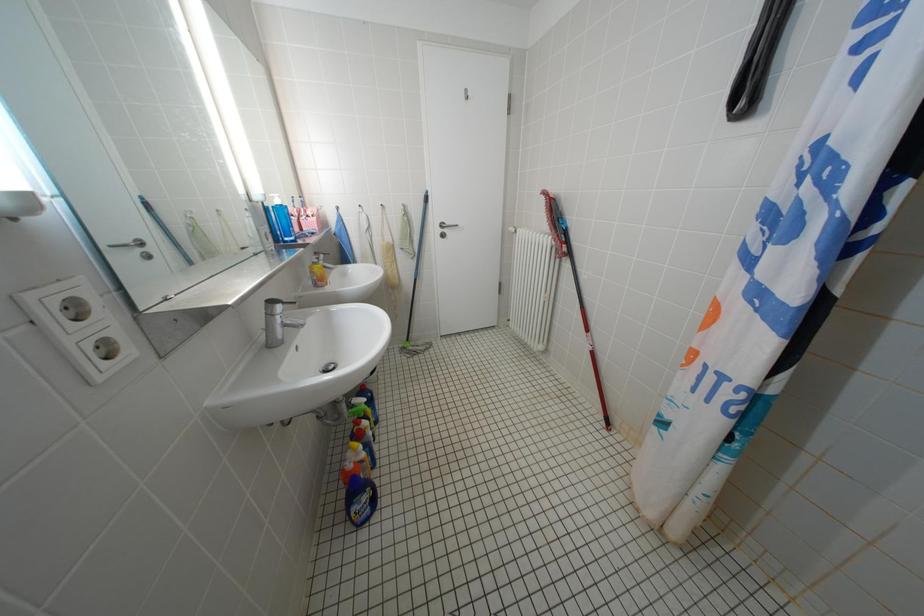
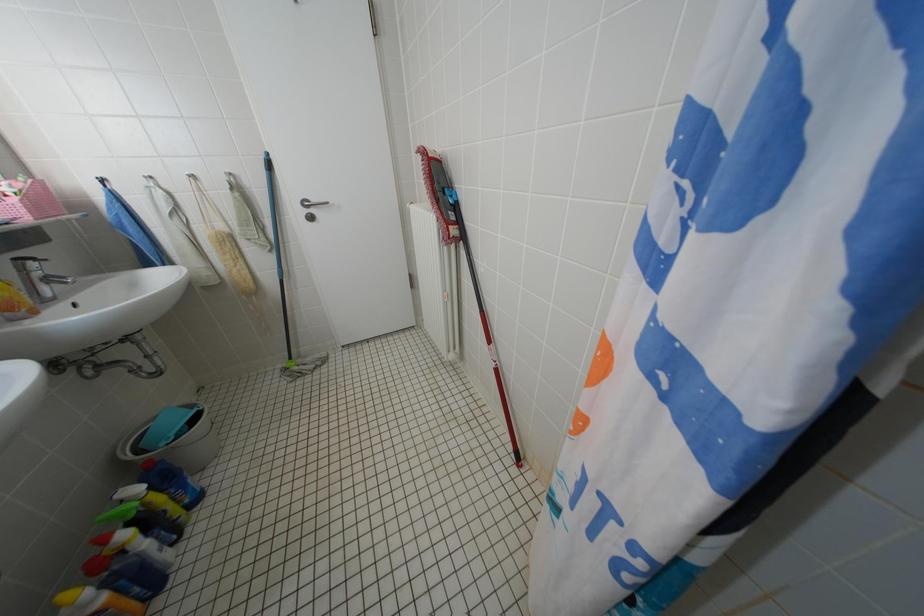
Question: The first image is from the beginning of the video and the second image is from the end. How did the camera likely rotate when shooting the video?

Choices:
 (A) Left
 (B) Right
 (C) Up
 (D) Down

Answer: (B)